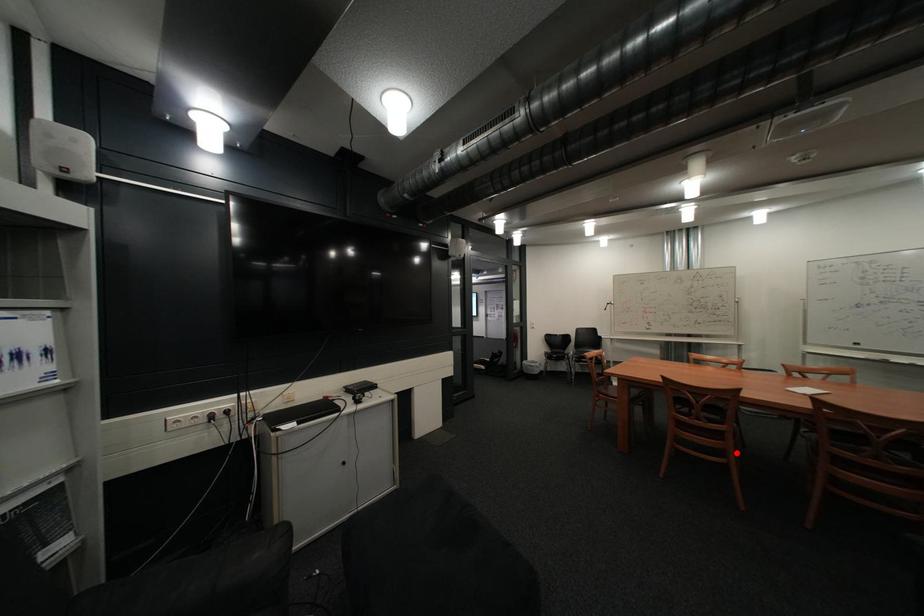
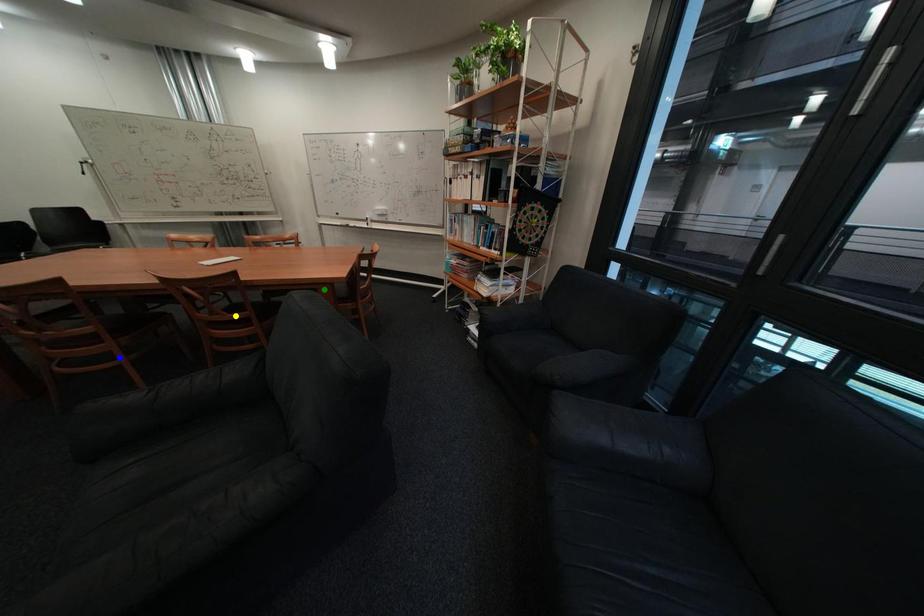
Question: I am providing you with two images of the same scene from different viewpoints. A red point is marked on the first image. You are given multiple points on the second image. In image 2, which mark is for the same physical point as the one in image 1?

Choices:
 (A) blue point
 (B) yellow point
 (C) green point

Answer: (A)